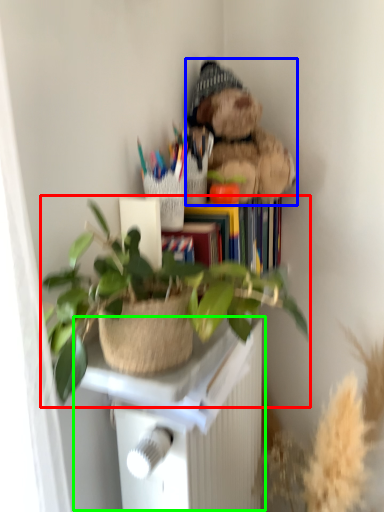
Question: Which is nearer to the houseplant (highlighted by a red box)? teddy bear (highlighted by a blue box) or table (highlighted by a green box).

Choices:
 (A) teddy bear
 (B) table

Answer: (B)